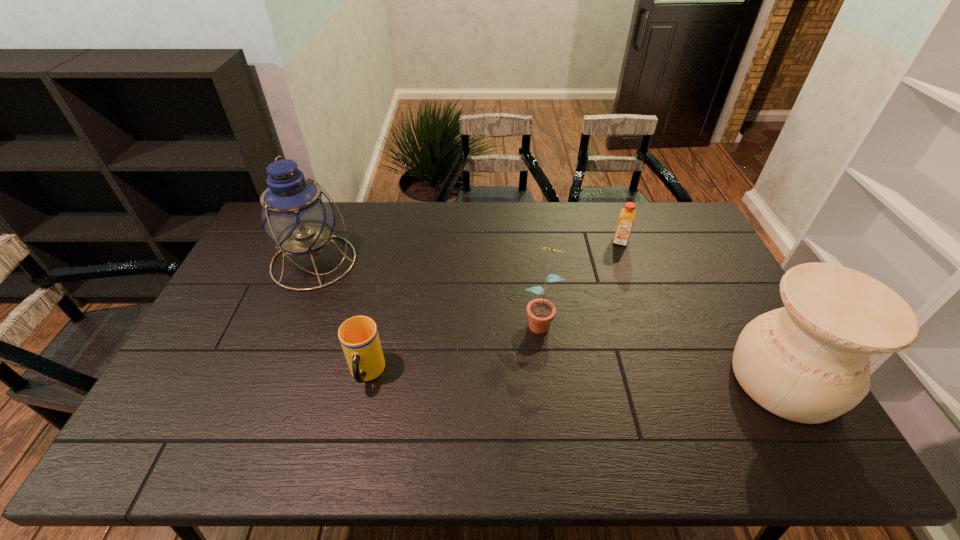
Find the location of a particular element. free space located 0.360m on the front-facing side of the lantern is located at coordinates (429, 326).

Find the location of a particular element. The image size is (960, 540). free spot located on the front-facing side of the lantern is located at coordinates (370, 293).

Where is `free space located 0.300m on the front-facing side of the lantern`? This screenshot has width=960, height=540. free space located 0.300m on the front-facing side of the lantern is located at coordinates (414, 317).

In order to click on free spot located on the flower of the third nearest object in this screenshot , I will do `click(521, 392)`.

Locate an element on the screen. The image size is (960, 540). vacant space situated 0.250m on the flower of the third nearest object is located at coordinates (516, 412).

At what (x,y) coordinates should I click in order to perform the action: click on vacant region located on the flower of the third nearest object. Please return your answer as a coordinate pair (x, y). This screenshot has width=960, height=540. Looking at the image, I should click on (532, 355).

You are a GUI agent. You are given a task and a screenshot of the screen. Output one action in this format:
    pyautogui.click(x=<x>, y=<y>)
    Task: Click on the orange juice present at the far edge
    
    Given the screenshot: What is the action you would take?
    pyautogui.click(x=626, y=219)

What are the coordinates of `lantern present at the far edge` in the screenshot? It's located at (296, 214).

Find the location of a particular element. cup that is at the near edge is located at coordinates (359, 338).

Locate an element on the screen. pottery at the near edge is located at coordinates (809, 362).